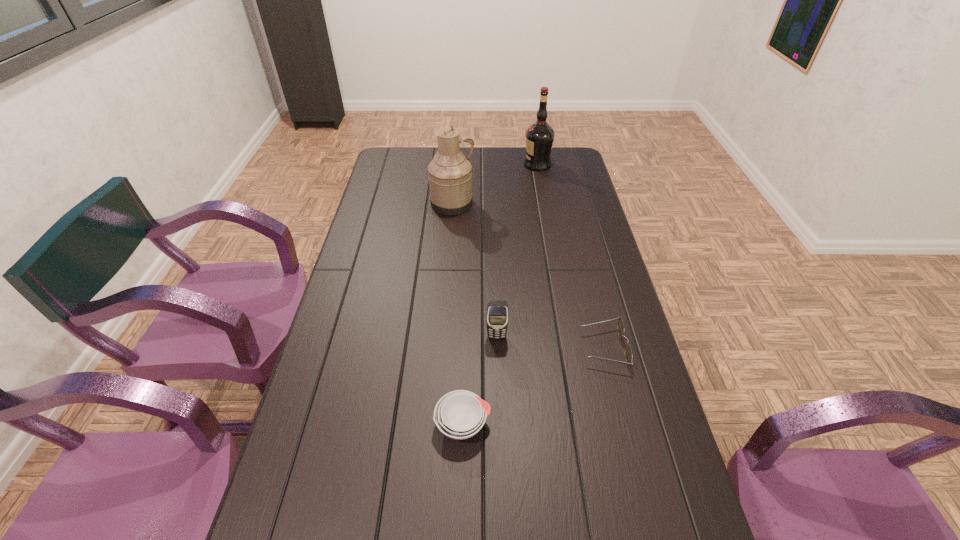
Where is `free space that is in between the spectacles and the soup bowl`? free space that is in between the spectacles and the soup bowl is located at coordinates (534, 386).

Point out which object is positioned as the third nearest to the nearest object. Please provide its 2D coordinates. Your answer should be formatted as a tuple, i.e. [(x, y)], where the tuple contains the x and y coordinates of a point satisfying the conditions above.

[(450, 177)]

Locate an element on the screen. the second closest object to the second farthest object is located at coordinates (497, 315).

The image size is (960, 540). Identify the location of vacant area that satisfies the following two spatial constraints: 1. on the surface of the farthest object; 2. on the front face of the cellular telephone. (568, 336).

This screenshot has height=540, width=960. I want to click on free location that satisfies the following two spatial constraints: 1. on the surface of the liquor; 2. on the front face of the third tallest object, so click(x=568, y=336).